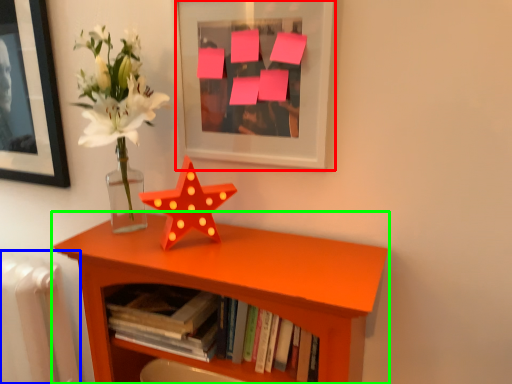
Question: Which object is the farthest from picture frame (highlighted by a red box)? Choose among these: radiator (highlighted by a blue box) or shelf (highlighted by a green box).

Choices:
 (A) radiator
 (B) shelf

Answer: (A)